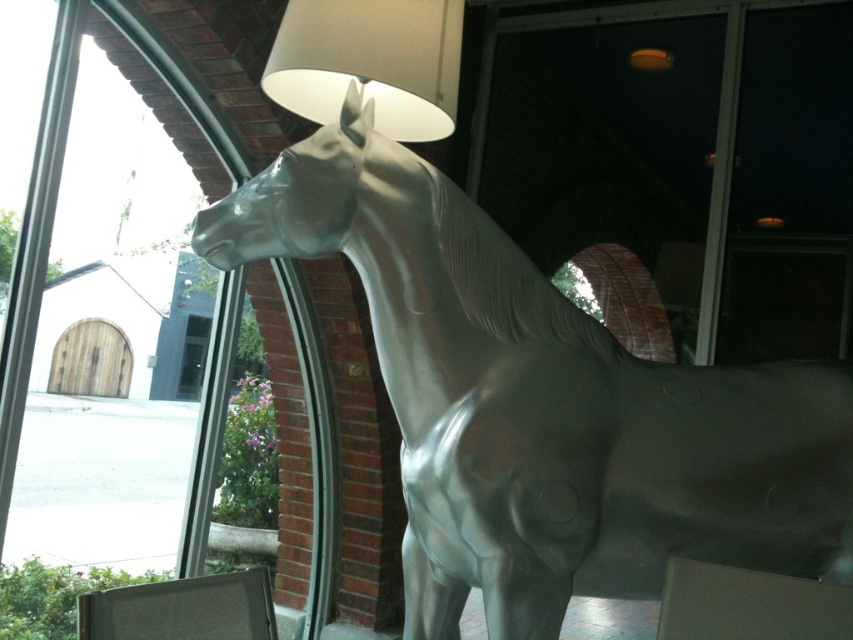
Question: Which point is farther from the camera taking this photo?

Choices:
 (A) (404, 534)
 (B) (378, 106)

Answer: (B)

Question: Is shiny metallic horse at center smaller than white matte lampshade at upper center?

Choices:
 (A) no
 (B) yes

Answer: (A)

Question: Is shiny metallic horse at center below white matte lampshade at upper center?

Choices:
 (A) yes
 (B) no

Answer: (A)

Question: Which point is farther to the camera?

Choices:
 (A) shiny metallic horse at center
 (B) white matte lampshade at upper center

Answer: (B)

Question: Is shiny metallic horse at center bigger than white matte lampshade at upper center?

Choices:
 (A) no
 (B) yes

Answer: (B)